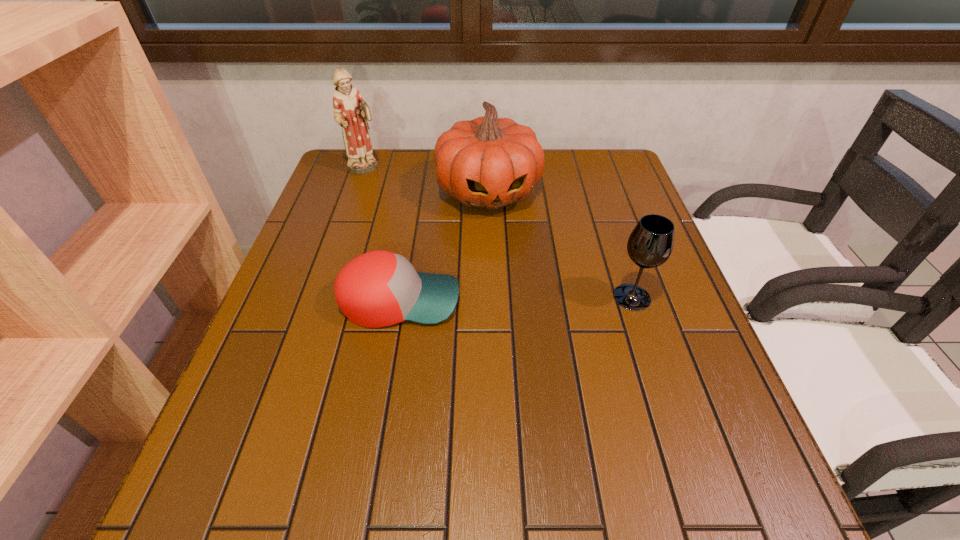
The height and width of the screenshot is (540, 960). I want to click on free space on the desktop that is between the baseball cap and the wineglass and is positioned on the face of the pumpkin, so 518,299.

In order to click on vacant space on the desktop that is between the baseball cap and the second shortest object and is positioned on the front-facing side of the figurine in this screenshot , I will do `click(485, 299)`.